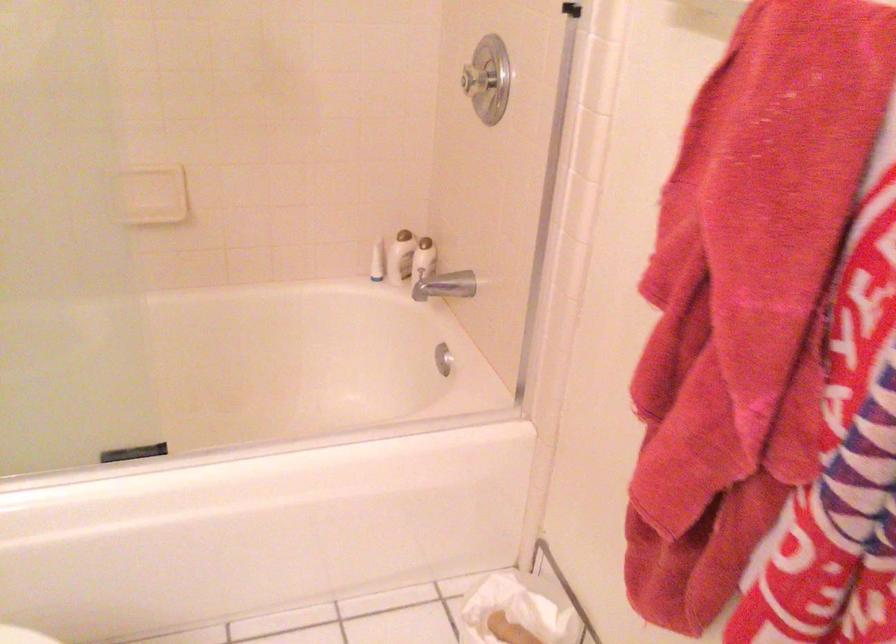
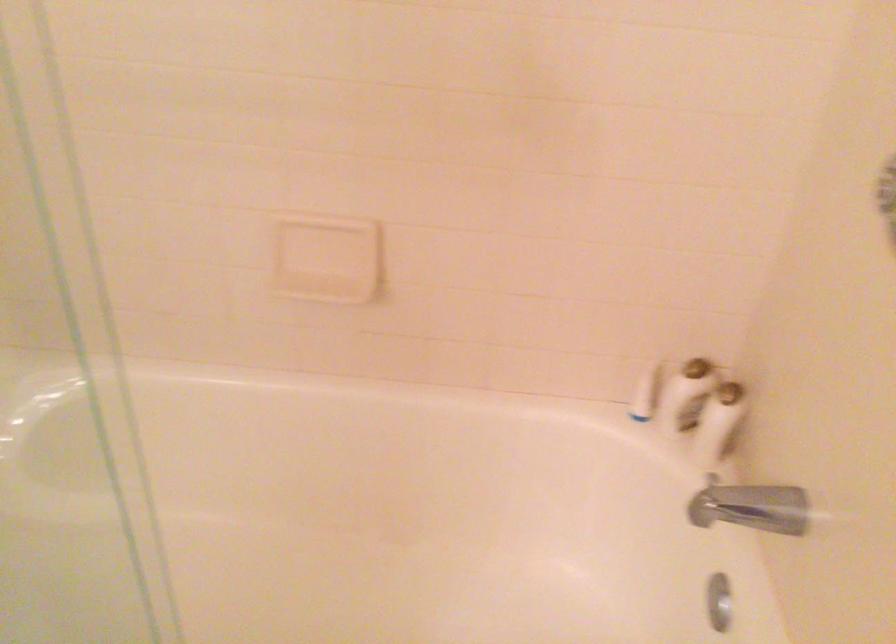
Locate, in the second image, the point that corresponds to point (423, 261) in the first image.

(718, 422)